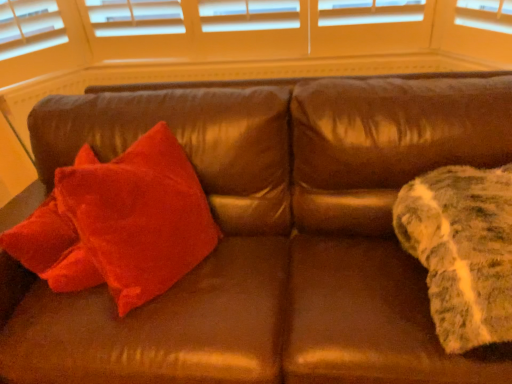
Question: From the image's perspective, is velvet red pillow at left below fuzzy white blanket at right?

Choices:
 (A) no
 (B) yes

Answer: (A)

Question: Is velvet red pillow at left positioned far away from fuzzy white blanket at right?

Choices:
 (A) yes
 (B) no

Answer: (B)

Question: From a real-world perspective, is velvet red pillow at left positioned under fuzzy white blanket at right based on gravity?

Choices:
 (A) no
 (B) yes

Answer: (B)

Question: From a real-world perspective, is velvet red pillow at left positioned over fuzzy white blanket at right based on gravity?

Choices:
 (A) yes
 (B) no

Answer: (B)

Question: Is velvet red pillow at left facing away from fuzzy white blanket at right?

Choices:
 (A) yes
 (B) no

Answer: (B)

Question: Would you say velvet red pillow at left contains fuzzy white blanket at right?

Choices:
 (A) yes
 (B) no

Answer: (B)

Question: Are fuzzy white blanket at right and velvet red pillow at left located far from each other?

Choices:
 (A) yes
 (B) no

Answer: (B)

Question: Considering the relative sizes of fuzzy white blanket at right and velvet red pillow at left in the image provided, is fuzzy white blanket at right bigger than velvet red pillow at left?

Choices:
 (A) yes
 (B) no

Answer: (B)

Question: Is fuzzy white blanket at right facing towards velvet red pillow at left?

Choices:
 (A) yes
 (B) no

Answer: (B)

Question: Is fuzzy white blanket at right closer to camera compared to velvet red pillow at left?

Choices:
 (A) no
 (B) yes

Answer: (B)

Question: Does fuzzy white blanket at right appear on the left side of velvet red pillow at left?

Choices:
 (A) no
 (B) yes

Answer: (A)

Question: Would you say velvet red pillow at left is part of fuzzy white blanket at right's contents?

Choices:
 (A) no
 (B) yes

Answer: (A)

Question: From a real-world perspective, is velvet red pillow at left physically located above or below fuzzy white blanket at right?

Choices:
 (A) below
 (B) above

Answer: (A)